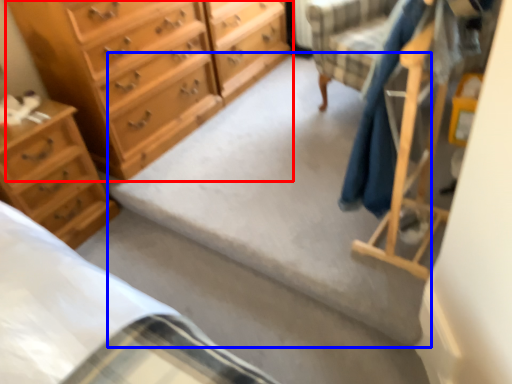
Question: Among these objects, which one is farthest to the camera, chest of drawers (highlighted by a red box) or concrete (highlighted by a blue box)?

Choices:
 (A) chest of drawers
 (B) concrete

Answer: (A)